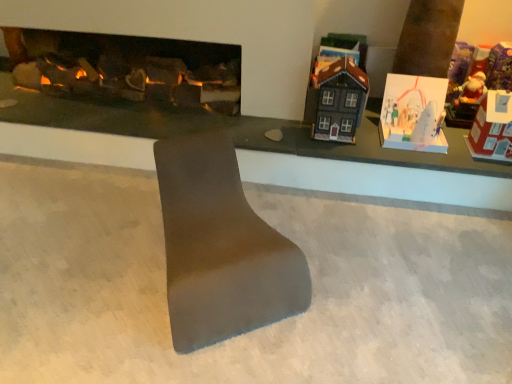
The height and width of the screenshot is (384, 512). Identify the location of vacant area to the left of dark gray matte house at upper right, the first toy in the left-to-right sequence. (298, 129).